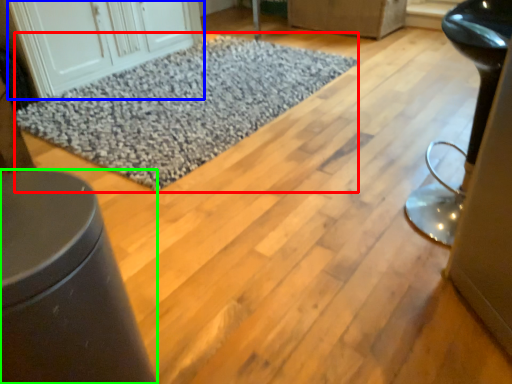
Question: Which object is positioned closest to mat (highlighted by a red box)? Select from cabinetry (highlighted by a blue box) and furniture (highlighted by a green box).

Choices:
 (A) cabinetry
 (B) furniture

Answer: (A)